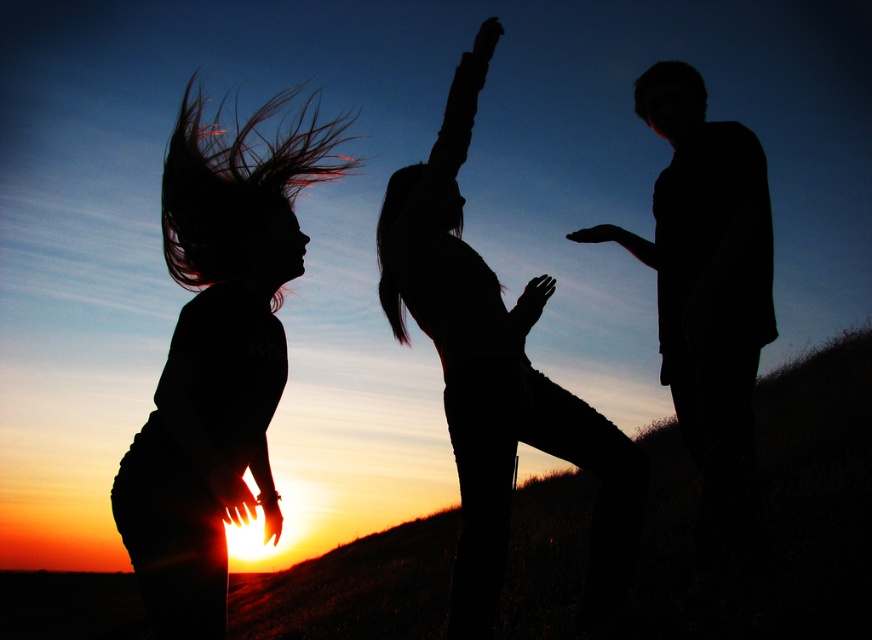
Question: Is black matte hair at left to the left of silhouette yoga pose at center from the viewer's perspective?

Choices:
 (A) yes
 (B) no

Answer: (A)

Question: Which object appears closest to the camera in this image?

Choices:
 (A) black matte hair at left
 (B) silhouette yoga pose at center

Answer: (A)

Question: Does black matte hair at left appear on the left side of silhouette man at right?

Choices:
 (A) yes
 (B) no

Answer: (A)

Question: Among these points, which one is farthest from the camera?

Choices:
 (A) (430, 316)
 (B) (713, 385)
 (C) (196, 401)

Answer: (B)

Question: Can you confirm if silhouette yoga pose at center is bigger than silhouette man at right?

Choices:
 (A) yes
 (B) no

Answer: (A)

Question: Which object is the farthest from the silhouette yoga pose at center?

Choices:
 (A) silhouette man at right
 (B) black matte hair at left

Answer: (A)